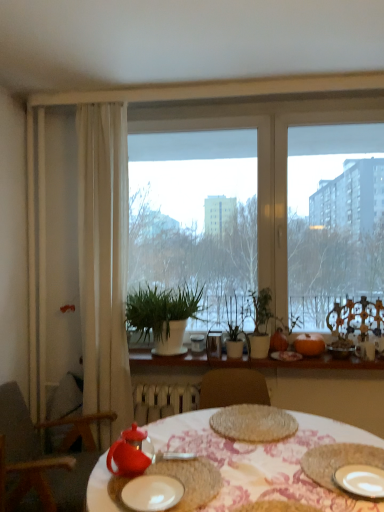
At what (x,y) coordinates should I click in order to perform the action: click on free space that is in between woven mat at center and matte red teapot at lower left. Please return your answer as a coordinate pair (x, y). Looking at the image, I should click on (228, 452).